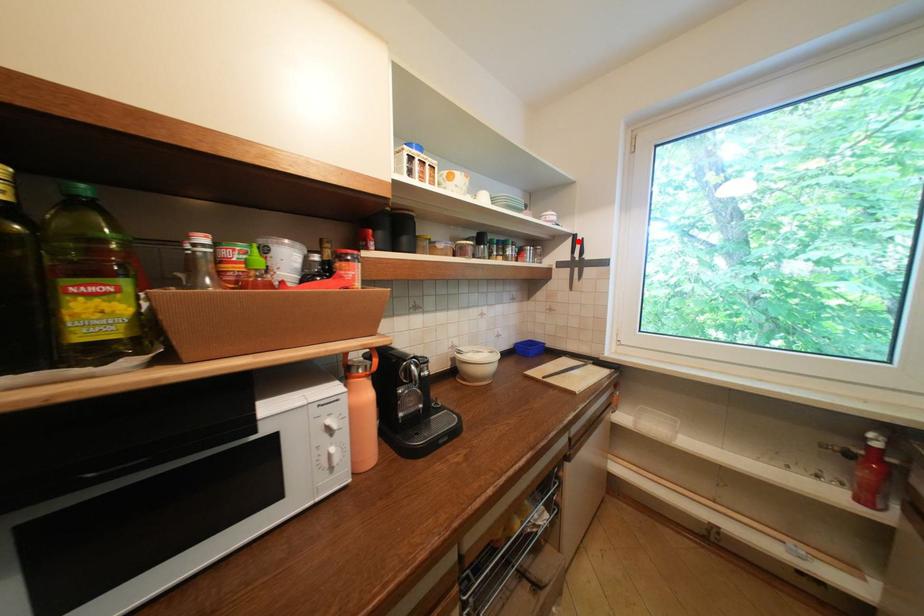
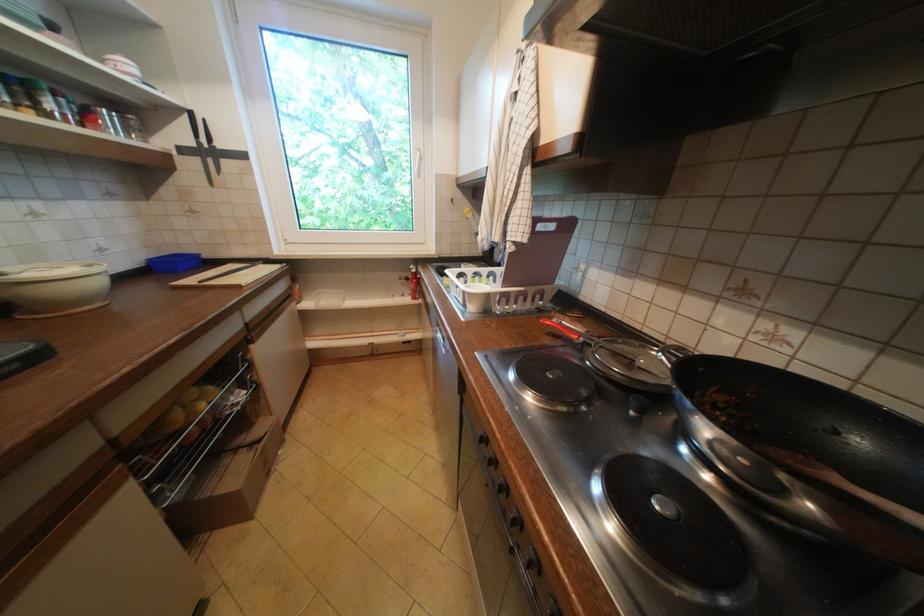
In the second image, find the point that corresponds to the highlighted location in the first image.

(195, 119)